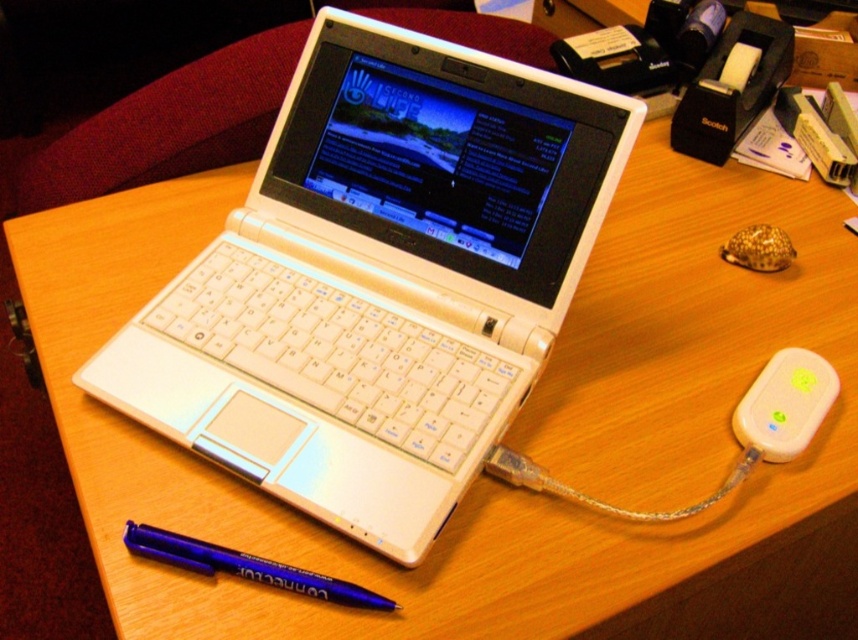
Which is below, white plastic laptop at center or blue metallic pen at lower left?

blue metallic pen at lower left is lower down.

Looking at this image, measure the distance between point (424, 346) and camera.

Point (424, 346) and camera are 26.55 inches apart.

In order to click on white plastic laptop at center in this screenshot , I will do `click(379, 280)`.

Which is in front, point (342, 454) or point (799, 445)?

Point (342, 454) is more forward.

Between point (299, 470) and point (816, 416), which one is positioned behind?

Positioned behind is point (816, 416).

Is point (360, 35) closer to viewer compared to point (820, 384)?

No, (360, 35) is further to viewer.

The height and width of the screenshot is (640, 858). In order to click on white plastic laptop at center in this screenshot , I will do `click(379, 280)`.

Is white plastic ipod at right bigger than blue metallic pen at lower left?

Correct, white plastic ipod at right is larger in size than blue metallic pen at lower left.

Looking at this image, measure the distance between white plastic ipod at right and camera.

white plastic ipod at right and camera are 24.39 inches apart from each other.

Which is behind, point (754, 426) or point (379, 608)?

The point (754, 426) is behind.

Identify the location of white plastic ipod at right. (784, 404).